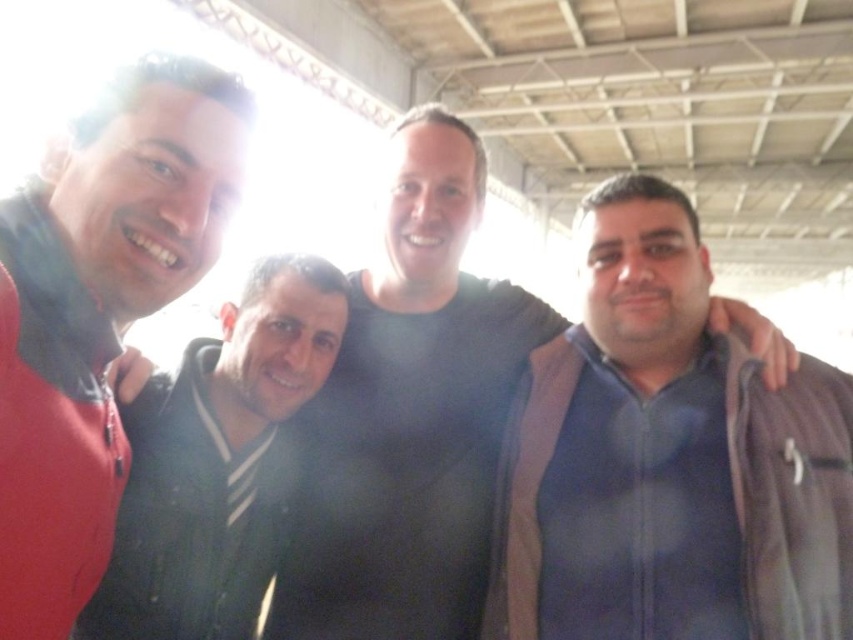
Question: Does dark blue zip-up jacket at right lie behind black matte shirt at center?

Choices:
 (A) no
 (B) yes

Answer: (A)

Question: Which point is closer to the camera?

Choices:
 (A) dark gray hoodie at center
 (B) black matte shirt at center
 (C) dark blue zip-up jacket at right
 (D) matte red jacket at left

Answer: (D)

Question: Among these points, which one is nearest to the camera?

Choices:
 (A) tap(54, 385)
 (B) tap(157, 499)
 (C) tap(511, 477)

Answer: (A)

Question: Does dark blue zip-up jacket at right appear on the right side of matte red jacket at left?

Choices:
 (A) yes
 (B) no

Answer: (A)

Question: Can you confirm if black matte shirt at center is wider than dark gray hoodie at center?

Choices:
 (A) yes
 (B) no

Answer: (A)

Question: Considering the real-world distances, which object is farthest from the black matte shirt at center?

Choices:
 (A) matte red jacket at left
 (B) dark blue zip-up jacket at right

Answer: (A)